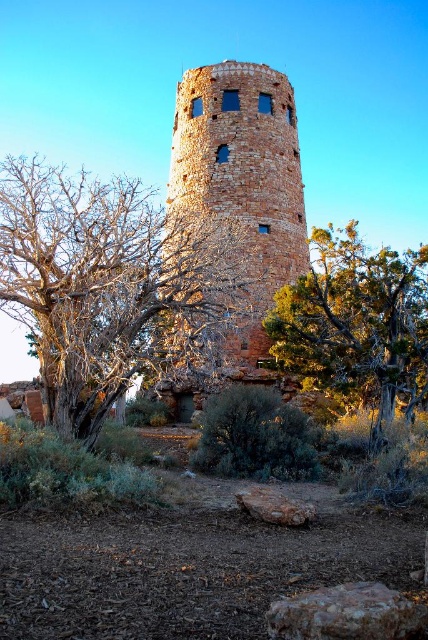
Question: Among these objects, which one is nearest to the camera?

Choices:
 (A) rustic brick tower at center
 (B) bare branches at center
 (C) green textured tree at center

Answer: (B)

Question: Can you confirm if rustic brick tower at center is positioned to the right of green textured tree at center?

Choices:
 (A) yes
 (B) no

Answer: (B)

Question: Based on their relative distances, which object is farther from the bare branches at center?

Choices:
 (A) green textured tree at center
 (B) rustic brick tower at center

Answer: (A)

Question: From the image, what is the correct spatial relationship of bare branches at center in relation to green textured tree at center?

Choices:
 (A) below
 (B) above

Answer: (B)

Question: Which point is farther to the camera?

Choices:
 (A) rustic brick tower at center
 (B) bare branches at center

Answer: (A)

Question: Does bare branches at center have a greater width compared to green textured tree at center?

Choices:
 (A) yes
 (B) no

Answer: (A)